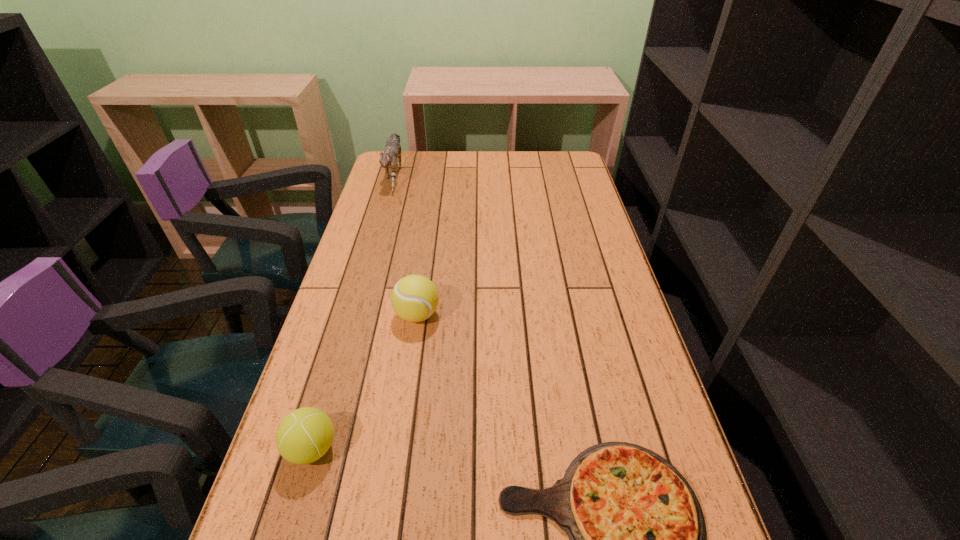
Identify the location of vacant area between the second farthest object and the third tallest object. This screenshot has width=960, height=540. (365, 382).

The image size is (960, 540). What are the coordinates of `free space that is in between the third tallest object and the right tennis ball` in the screenshot? It's located at (365, 382).

Find the location of a particular element. Image resolution: width=960 pixels, height=540 pixels. object identified as the closest to the second object from right to left is located at coordinates (306, 434).

Select which object is the closest to the right tennis ball. Please provide its 2D coordinates. Your answer should be formatted as a tuple, i.e. [(x, y)], where the tuple contains the x and y coordinates of a point satisfying the conditions above.

[(306, 434)]

Where is `vacant space that satisfies the following two spatial constraints: 1. on the back side of the second farthest object; 2. on the left side of the left tennis ball`? The height and width of the screenshot is (540, 960). vacant space that satisfies the following two spatial constraints: 1. on the back side of the second farthest object; 2. on the left side of the left tennis ball is located at coordinates pos(351,315).

Find the location of `vacant region that satisfies the following two spatial constraints: 1. on the face of the cat; 2. on the left side of the farther tennis ball`. vacant region that satisfies the following two spatial constraints: 1. on the face of the cat; 2. on the left side of the farther tennis ball is located at coordinates (353, 315).